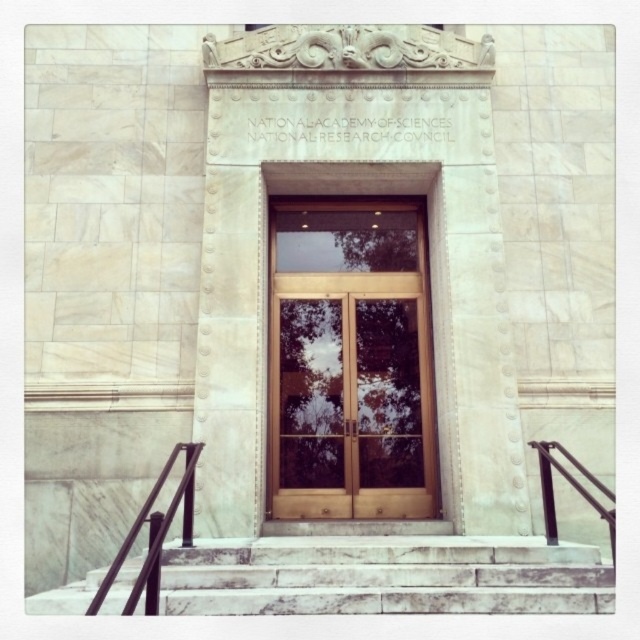
You are a visitor arriving at the National Academy of Sciences and the National Research Council. You see the glossy wood door at center and the white marble stairs at center. Which object is taller?

The glossy wood door at center is much taller than the white marble stairs at center.

You are an architect designing a new building entrance. You want to ensure that the glossy wood door at center is visually balanced with the white marble stairs at center. Given their widths, which object should you adjust to achieve symmetry?

The glossy wood door at center has a lesser width compared to white marble stairs at center. To achieve symmetry, you should widen the glossy wood door at center to match the width of the white marble stairs at center.